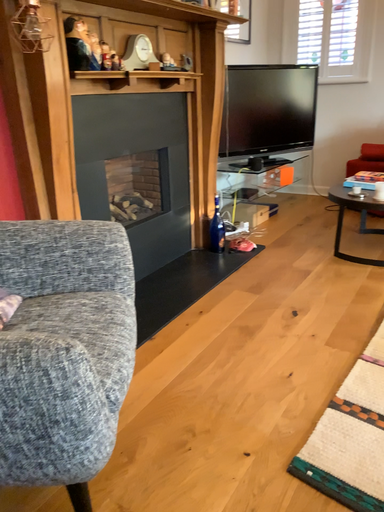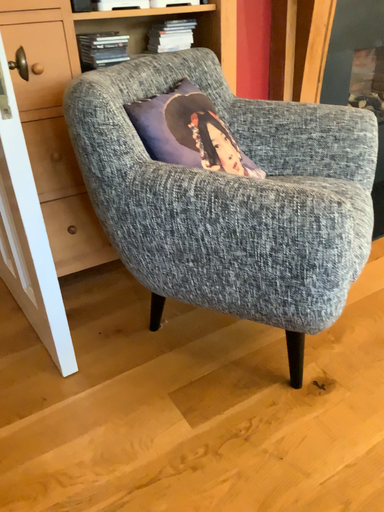
Question: Which way did the camera rotate in the video?

Choices:
 (A) rotated downward
 (B) rotated upward

Answer: (A)